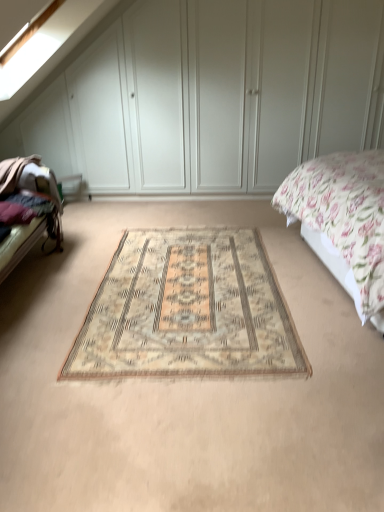
At what (x,y) coordinates should I click in order to perform the action: click on beige woven rug at center. Please return your answer as a coordinate pair (x, y). Image resolution: width=384 pixels, height=512 pixels. Looking at the image, I should click on (188, 310).

Measure the distance between point (379, 282) and camera.

Point (379, 282) is 6.50 feet from camera.

Locate an element on the screen. The image size is (384, 512). floral fabric bed at right is located at coordinates (343, 221).

This screenshot has height=512, width=384. What do you see at coordinates (185, 390) in the screenshot? I see `beige carpet at center` at bounding box center [185, 390].

Image resolution: width=384 pixels, height=512 pixels. Describe the element at coordinates (212, 96) in the screenshot. I see `white matte wardrobe at center` at that location.

The image size is (384, 512). Find the location of `beige woven rug at center`. beige woven rug at center is located at coordinates (188, 310).

Would you say dark brown fabric bed frame at left is part of beige woven rug at center's contents?

No, dark brown fabric bed frame at left is located outside of beige woven rug at center.

From a real-world perspective, is beige woven rug at center positioned under dark brown fabric bed frame at left based on gravity?

Correct, in the physical world, beige woven rug at center is lower than dark brown fabric bed frame at left.

Which is less distant, (286, 310) or (51, 211)?

Clearly, point (286, 310) is closer to the camera than point (51, 211).

Is beige woven rug at center positioned with its back to dark brown fabric bed frame at left?

Result: That's not correct — beige woven rug at center is not looking away from dark brown fabric bed frame at left.

In the image, there is a white matte wardrobe at center. What are the coordinates of `bed below it (from a real-world perspective)` in the screenshot? It's located at (343, 221).

Considering their positions, is white matte wardrobe at center located in front of or behind floral fabric bed at right?

Visually, white matte wardrobe at center is located behind floral fabric bed at right.

How different are the orientations of white matte wardrobe at center and floral fabric bed at right in degrees?

83.9 degrees separate the facing orientations of white matte wardrobe at center and floral fabric bed at right.

Is white matte wardrobe at center with floral fabric bed at right?

No, white matte wardrobe at center is not touching floral fabric bed at right.

Is floral fabric bed at right a part of beige woven rug at center?

No, floral fabric bed at right is not inside beige woven rug at center.

The image size is (384, 512). In order to click on bed above the beige woven rug at center (from a real-world perspective) in this screenshot , I will do `click(343, 221)`.

From the image's perspective, who appears lower, beige woven rug at center or floral fabric bed at right?

From the image's view, beige woven rug at center is below.

Who is more distant, beige woven rug at center or floral fabric bed at right?

beige woven rug at center is further from the camera.

Between point (352, 238) and point (158, 318), which one is positioned behind?

Positioned behind is point (158, 318).

Is floral fabric bed at right inside the boundaries of beige woven rug at center, or outside?

floral fabric bed at right is spatially situated outside beige woven rug at center.

How much distance is there between floral fabric bed at right and beige woven rug at center?

floral fabric bed at right and beige woven rug at center are 28.94 inches apart.

Is floral fabric bed at right turned away from beige woven rug at center?

No, floral fabric bed at right is not facing the opposite direction of beige woven rug at center.

Can you confirm if beige carpet at center is smaller than dark brown fabric bed frame at left?

No, beige carpet at center is not smaller than dark brown fabric bed frame at left.

Which point is more forward, (300, 449) or (17, 212)?

Positioned in front is point (300, 449).

How different are the orientations of beige carpet at center and dark brown fabric bed frame at left in degrees?

The facing directions of beige carpet at center and dark brown fabric bed frame at left are 89.4 degrees apart.

Is beige carpet at center taller or shorter than dark brown fabric bed frame at left?

beige carpet at center is shorter than dark brown fabric bed frame at left.

Are dark brown fabric bed frame at left and beige carpet at center located far from each other?

They are positioned close to each other.

Which object is closer to the camera, dark brown fabric bed frame at left or beige carpet at center?

beige carpet at center is closer to the camera.

Is beige carpet at center at the back of dark brown fabric bed frame at left?

dark brown fabric bed frame at left does not have its back to beige carpet at center.

Is dark brown fabric bed frame at left situated inside beige carpet at center or outside?

dark brown fabric bed frame at left cannot be found inside beige carpet at center.

In the image, there is a white matte wardrobe at center. Find the location of `bed frame below it (from a real-world perspective)`. bed frame below it (from a real-world perspective) is located at coordinates (29, 211).

Is dark brown fabric bed frame at left not close to white matte wardrobe at center?

Yes, dark brown fabric bed frame at left and white matte wardrobe at center are quite far apart.

Measure the distance from dark brown fabric bed frame at left to white matte wardrobe at center.

dark brown fabric bed frame at left and white matte wardrobe at center are 5.92 feet apart from each other.

Based on their sizes in the image, would you say dark brown fabric bed frame at left is bigger or smaller than white matte wardrobe at center?

In the image, dark brown fabric bed frame at left appears to be smaller than white matte wardrobe at center.

Identify the location of mat on the right of dark brown fabric bed frame at left. Image resolution: width=384 pixels, height=512 pixels. (188, 310).

This screenshot has width=384, height=512. I want to click on dresser above the floral fabric bed at right (from the image's perspective), so click(x=212, y=96).

Estimate the real-world distances between objects in this image. Which object is further from beige woven rug at center, beige carpet at center or floral fabric bed at right?

Among the two, floral fabric bed at right is located further to beige woven rug at center.

Estimate the real-world distances between objects in this image. Which object is closer to beige woven rug at center, floral fabric bed at right or beige carpet at center?

beige carpet at center is closer to beige woven rug at center.

When comparing their distances from beige woven rug at center, does white matte wardrobe at center or dark brown fabric bed frame at left seem closer?

dark brown fabric bed frame at left is positioned closer to the anchor beige woven rug at center.

Looking at the image, which one is located closer to floral fabric bed at right, white matte wardrobe at center or dark brown fabric bed frame at left?

white matte wardrobe at center is closer to floral fabric bed at right.

Which object lies nearer to the anchor point white matte wardrobe at center, beige woven rug at center or floral fabric bed at right?

floral fabric bed at right is closer to white matte wardrobe at center.

When comparing their distances from dark brown fabric bed frame at left, does beige woven rug at center or floral fabric bed at right seem further?

The object further to dark brown fabric bed frame at left is floral fabric bed at right.

Looking at the image, which one is located further to beige carpet at center, white matte wardrobe at center or beige woven rug at center?

Among the two, white matte wardrobe at center is located further to beige carpet at center.

Estimate the real-world distances between objects in this image. Which object is further from beige carpet at center, floral fabric bed at right or dark brown fabric bed frame at left?

dark brown fabric bed frame at left is further to beige carpet at center.

Locate an element on the screen. mat positioned between floral fabric bed at right and white matte wardrobe at center from near to far is located at coordinates pyautogui.click(x=188, y=310).

At what (x,y) coordinates should I click in order to perform the action: click on plain between dark brown fabric bed frame at left and floral fabric bed at right from left to right. Please return your answer as a coordinate pair (x, y). The height and width of the screenshot is (512, 384). Looking at the image, I should click on (185, 390).

At what (x,y) coordinates should I click in order to perform the action: click on mat positioned between beige carpet at center and white matte wardrobe at center from near to far. Please return your answer as a coordinate pair (x, y). Looking at the image, I should click on (188, 310).

Where is `mat between dark brown fabric bed frame at left and floral fabric bed at right from left to right`? mat between dark brown fabric bed frame at left and floral fabric bed at right from left to right is located at coordinates tap(188, 310).